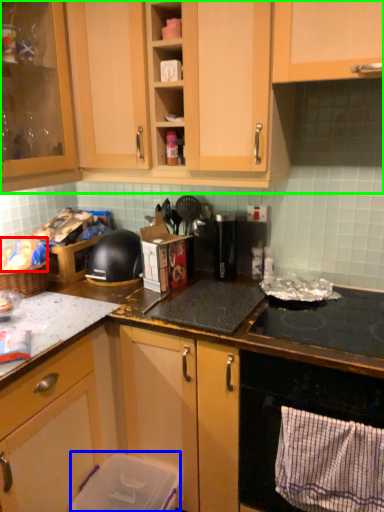
Question: Which is nearer to the food (highlighted by a red box)? appliance (highlighted by a blue box) or cabinetry (highlighted by a green box).

Choices:
 (A) appliance
 (B) cabinetry

Answer: (B)